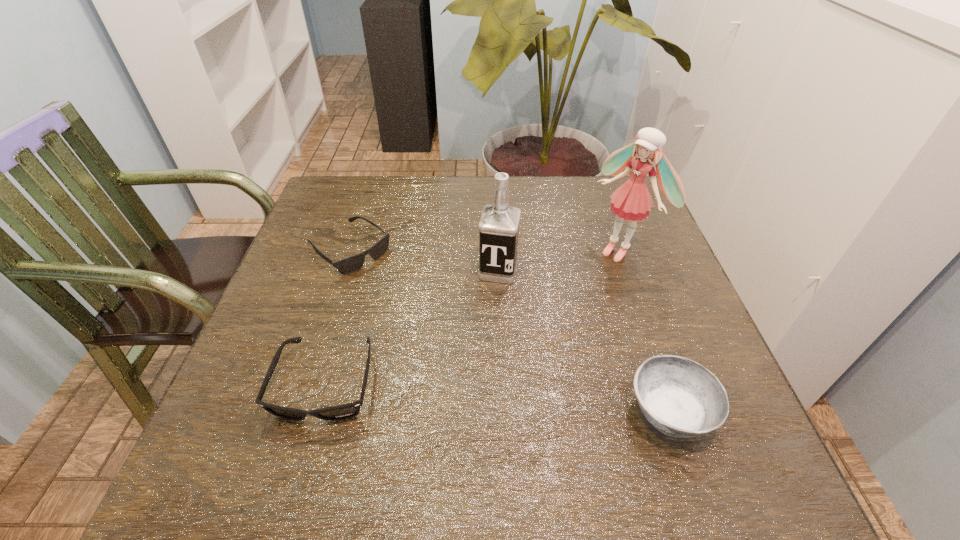
At what (x,y) coordinates should I click in order to perform the action: click on ashtray at the near edge. Please return your answer as a coordinate pair (x, y). The height and width of the screenshot is (540, 960). Looking at the image, I should click on (681, 398).

You are a GUI agent. You are given a task and a screenshot of the screen. Output one action in this format:
    pyautogui.click(x=<x>, y=<y>)
    Task: Click on the ashtray at the right edge
    This screenshot has width=960, height=540.
    Given the screenshot: What is the action you would take?
    pyautogui.click(x=681, y=398)

At what (x,y) coordinates should I click in order to perform the action: click on doll that is at the right edge. Please return your answer as a coordinate pair (x, y). The image size is (960, 540). Looking at the image, I should click on (632, 201).

The width and height of the screenshot is (960, 540). What are the coordinates of `object located in the far left corner section of the desktop` in the screenshot? It's located at (352, 263).

This screenshot has width=960, height=540. What are the coordinates of `object that is at the near left corner` in the screenshot? It's located at (340, 412).

At what (x,y) coordinates should I click in order to perform the action: click on object located in the near right corner section of the desktop. Please return your answer as a coordinate pair (x, y). Looking at the image, I should click on [681, 398].

Find the location of a particular element. free space at the far edge of the desktop is located at coordinates (479, 198).

The image size is (960, 540). In the image, there is a desktop. In order to click on vacant area at the near edge in this screenshot , I will do `click(489, 422)`.

The image size is (960, 540). Identify the location of vacant space at the right edge of the desktop. (657, 229).

In the image, there is a desktop. Where is `free space at the far right corner`? This screenshot has width=960, height=540. free space at the far right corner is located at coordinates (610, 194).